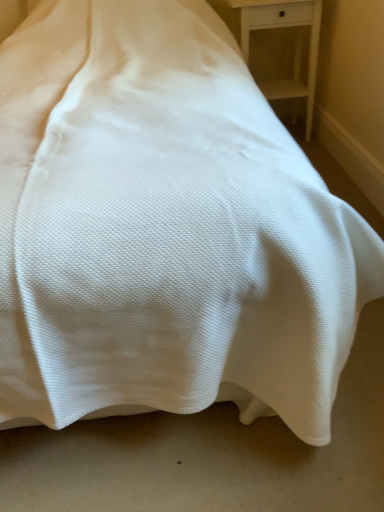
Describe the element at coordinates (295, 47) in the screenshot. I see `white wood nightstand at upper right` at that location.

In order to click on white wood nightstand at upper right in this screenshot , I will do `click(295, 47)`.

Where is `white wood nightstand at upper right`? The height and width of the screenshot is (512, 384). white wood nightstand at upper right is located at coordinates (295, 47).